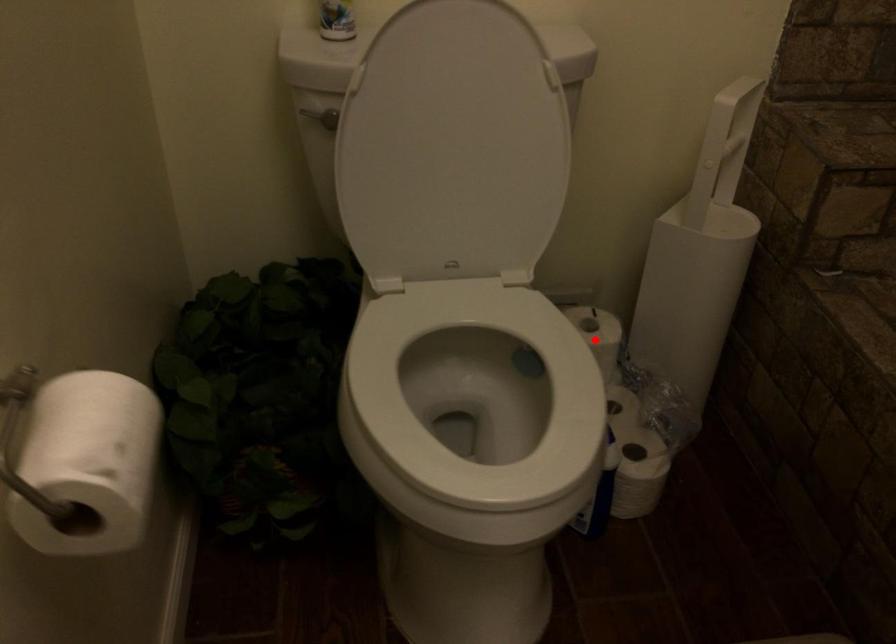
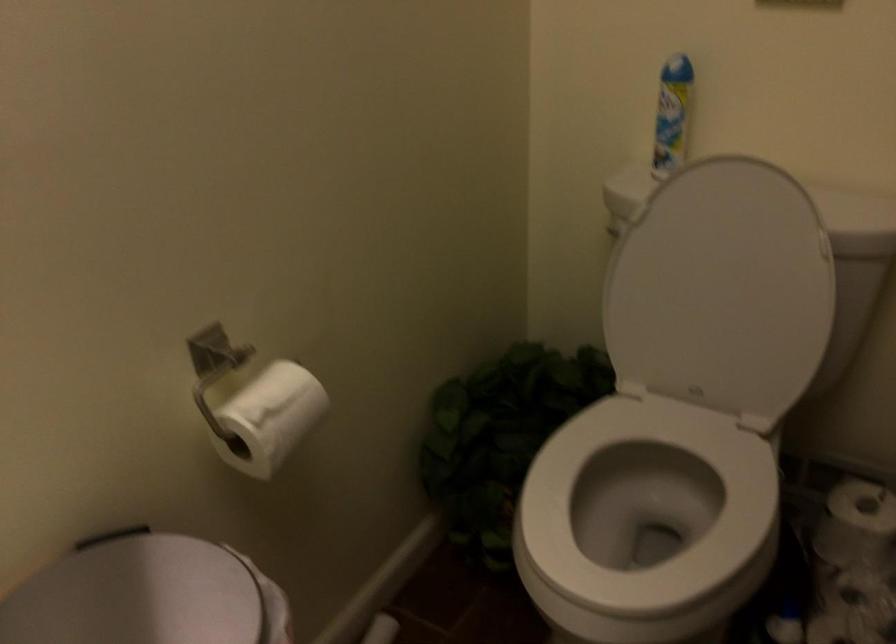
Question: I am providing you with two images of the same scene from different viewpoints. In image1, a red point is highlighted. Considering the same 3D point in image2, which of the following is correct?

Choices:
 (A) It is closer
 (B) It is farther

Answer: (A)